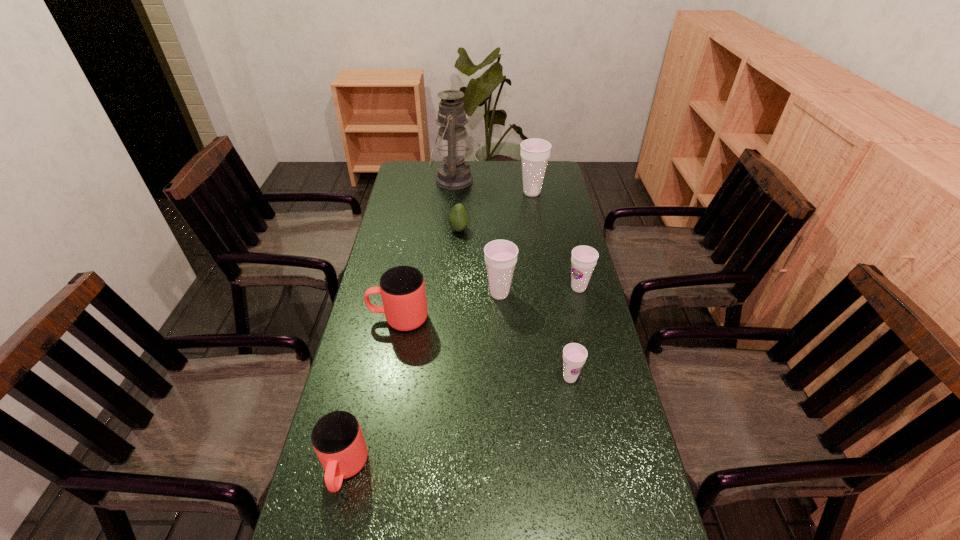
At what (x,y) coordinates should I click in order to perform the action: click on cup that is the second nearest to the tallest object. Please return your answer as a coordinate pair (x, y). This screenshot has width=960, height=540. Looking at the image, I should click on (500, 255).

Locate which cup ranks in proximity to the nearest object. Please provide its 2D coordinates. Your answer should be formatted as a tuple, i.e. [(x, y)], where the tuple contains the x and y coordinates of a point satisfying the conditions above.

[(402, 288)]

At what (x,y) coordinates should I click in order to perform the action: click on purple cup that is the closest to the nearest cup. Please return your answer as a coordinate pair (x, y). Looking at the image, I should click on point(574,355).

Locate which purple cup ranks in proximity to the second tallest object. Please provide its 2D coordinates. Your answer should be formatted as a tuple, i.e. [(x, y)], where the tuple contains the x and y coordinates of a point satisfying the conditions above.

[(584, 258)]

You are a GUI agent. You are given a task and a screenshot of the screen. Output one action in this format:
    pyautogui.click(x=<x>, y=<y>)
    Task: Click on the pink cup that is the closest to the avocado
    The height and width of the screenshot is (540, 960).
    Given the screenshot: What is the action you would take?
    pyautogui.click(x=402, y=288)

The width and height of the screenshot is (960, 540). Identify the location of pink cup that stands as the closest to the second nearest cup. (402, 288).

The height and width of the screenshot is (540, 960). Identify the location of vacant area that satisfies the following two spatial constraints: 1. on the handle side of the farther pink cup; 2. on the left side of the third smallest purple cup. (403, 293).

Where is `vacant region that satisfies the following two spatial constraints: 1. on the handle side of the farther pink cup; 2. on the right side of the tallest object`? This screenshot has width=960, height=540. vacant region that satisfies the following two spatial constraints: 1. on the handle side of the farther pink cup; 2. on the right side of the tallest object is located at coordinates (424, 180).